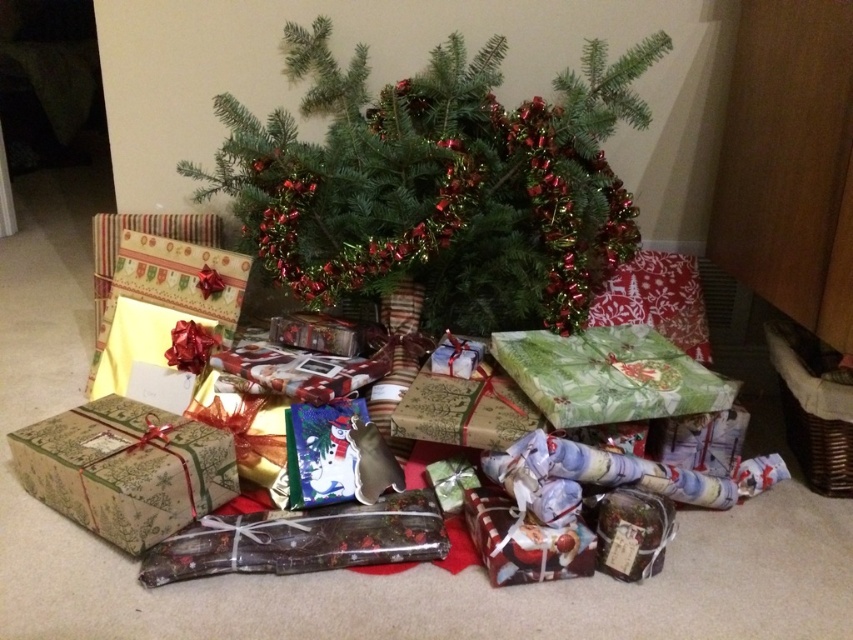
Question: Which point is farther to the camera?

Choices:
 (A) santa-themed paper gift at center
 (B) matte green paper gift at lower left
 (C) shiny metallic wrapping paper at center
 (D) matte brown jar at lower right

Answer: (D)

Question: Estimate the real-world distances between objects in this image. Which object is farther from the shiny metallic wrapping paper at center?

Choices:
 (A) matte green paper gift at lower left
 (B) santa-themed paper gift at center

Answer: (B)

Question: Does shiny metallic wrapping paper at center have a greater width compared to santa-themed paper gift at center?

Choices:
 (A) yes
 (B) no

Answer: (A)

Question: Which of the following is the farthest from the observer?

Choices:
 (A) (490, 572)
 (B) (328, 548)
 (C) (276, 278)

Answer: (C)

Question: Is matte green paper gift at lower left to the left of matte brown jar at lower right from the viewer's perspective?

Choices:
 (A) no
 (B) yes

Answer: (B)

Question: Does green textured christmas tree at center appear on the left side of santa-themed paper gift at center?

Choices:
 (A) yes
 (B) no

Answer: (A)